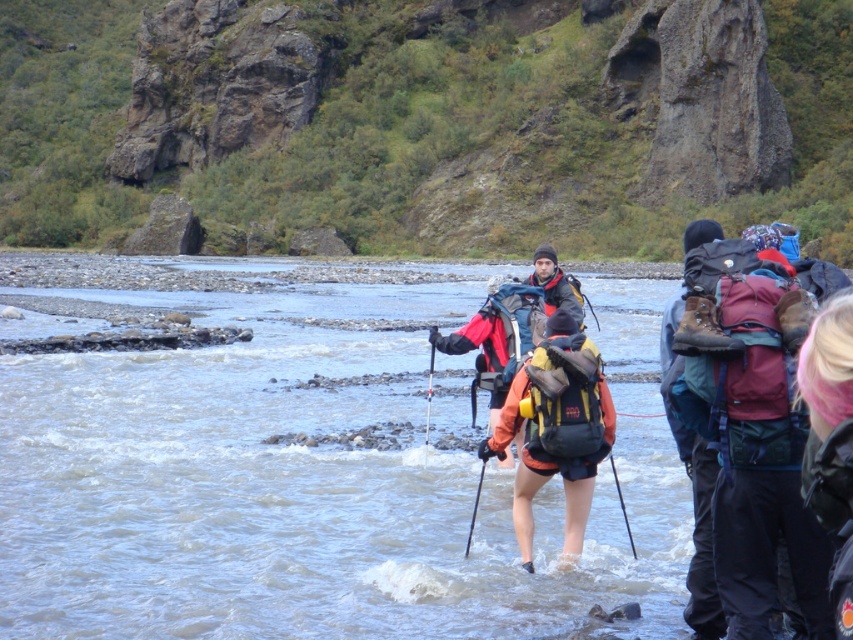
You are a drone operator tasked with capturing aerial footage of the hikers. You notice the orange fabric backpack at center and the pink hair at lower right. To ensure both are in frame, what is the minimum distance your drone should maintain between them?

The orange fabric backpack at center and pink hair at lower right are 7.18 meters apart from each other. To ensure both are in frame, the drone should maintain a distance that can cover at least 7.18 meters between them.